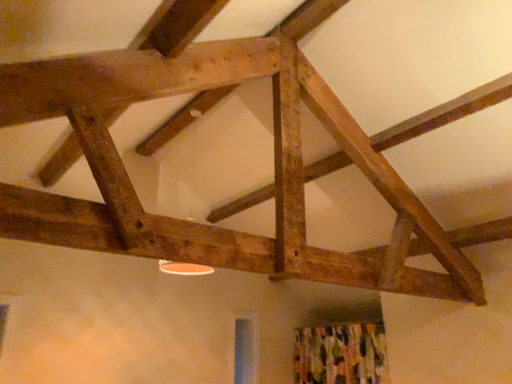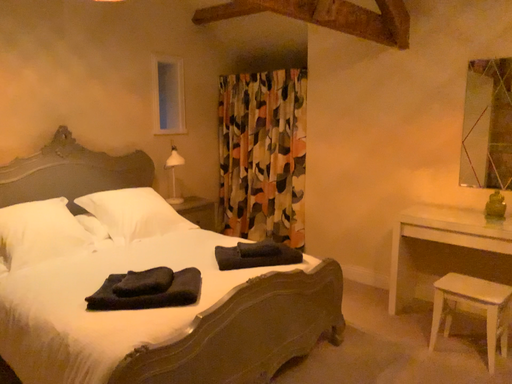
Question: Which way did the camera rotate in the video?

Choices:
 (A) rotated upward
 (B) rotated downward

Answer: (B)